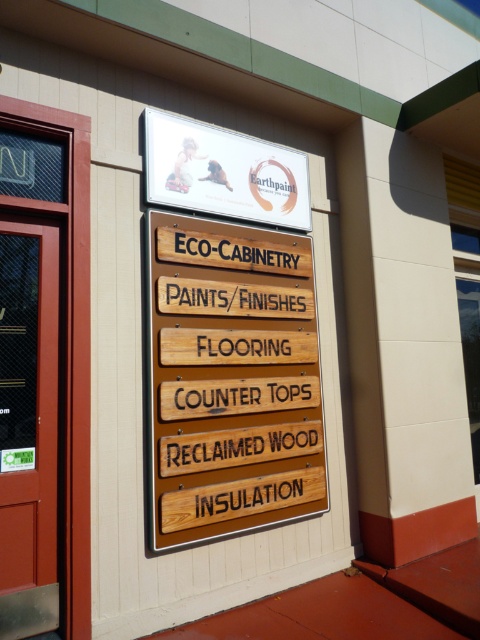
Can you confirm if wooden sign at center is shorter than matte glass door at left?

Correct, wooden sign at center is not as tall as matte glass door at left.

Is wooden sign at center bigger than matte glass door at left?

Yes, wooden sign at center is bigger than matte glass door at left.

The height and width of the screenshot is (640, 480). Describe the element at coordinates (230, 380) in the screenshot. I see `wooden sign at center` at that location.

Image resolution: width=480 pixels, height=640 pixels. Find the location of `wooden sign at center`. wooden sign at center is located at coordinates (230, 380).

Is point (284, 380) closer to camera compared to point (298, 170)?

Yes, it is in front of point (298, 170).

Is wooden sign at center positioned before white matte sign at upper center?

Yes, it is.

Does point (163, 522) come behind point (175, 134)?

No, it is in front of (175, 134).

Identify the location of wooden sign at center. (230, 380).

Between matte glass door at left and white matte sign at upper center, which one is positioned lower?

matte glass door at left is lower down.

Between point (68, 604) and point (194, 192), which one is positioned behind?

Point (194, 192)

Does point (19, 145) come farther from viewer compared to point (305, 182)?

No, it is not.

Identify the location of matte glass door at left. (44, 371).